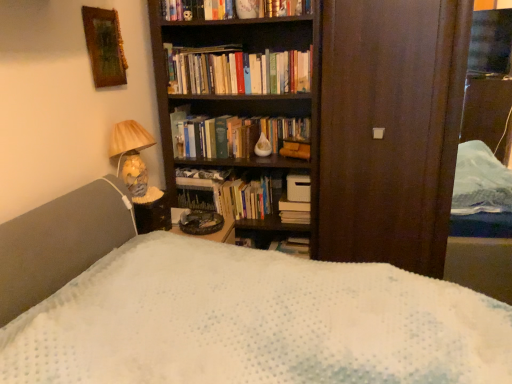
Where is `free space above hardcover book at center, positioned as the second book in front-to-back order (from a real-world perspective)`? free space above hardcover book at center, positioned as the second book in front-to-back order (from a real-world perspective) is located at coordinates (228, 181).